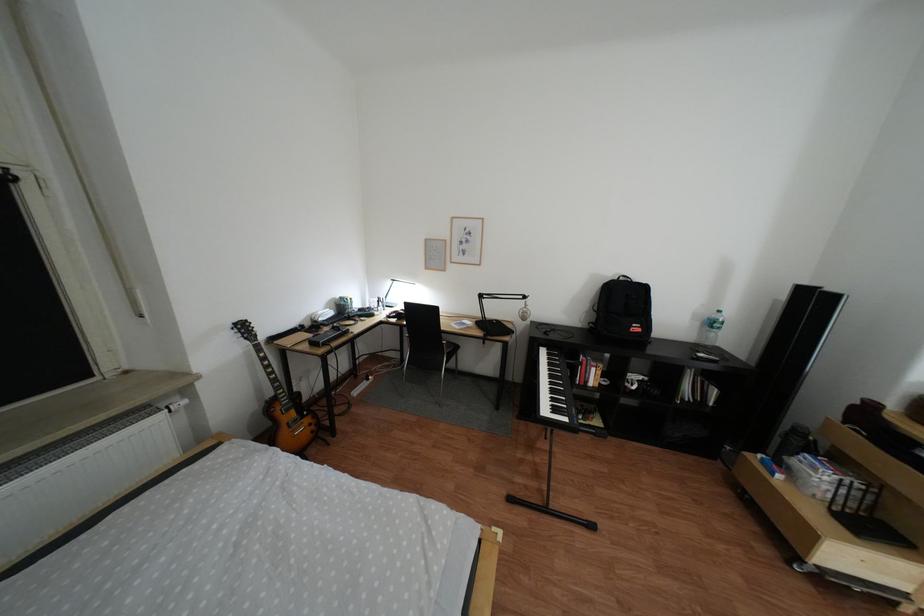
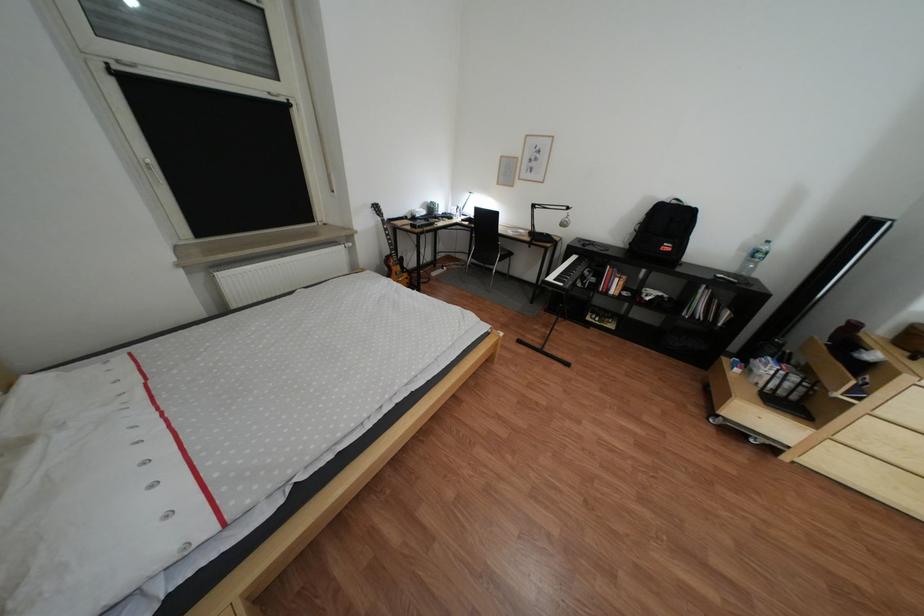
Where in the second image is the point corresponding to (x=562, y=334) from the first image?

(600, 246)